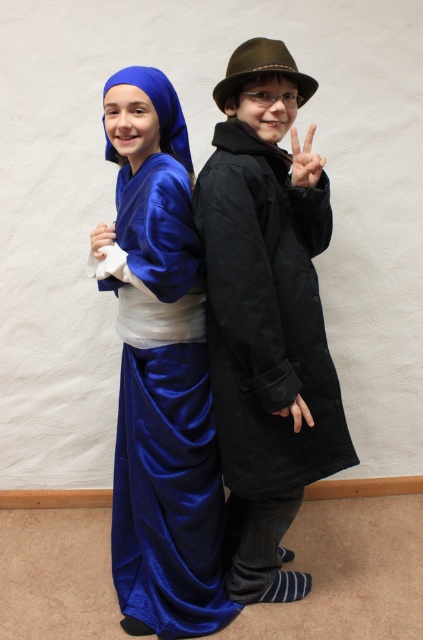
You are standing in front of the image and want to locate the point at coordinates point (266, 321). Which object is this point located on?

The point (266, 321) is located on the satin blue robe at center.

You are a photographer trying to capture a closeup of both hands in the image. Given that your camera can only focus on objects within 18 inches of each other, will you need to adjust the distance between the matte black hand at upper center and the white matte hand at center to get both in focus?

The distance between the matte black hand at upper center and the white matte hand at center is 19.03 inches, which is slightly more than the 18 inches required for the camera to focus. Therefore, you will need to move the hands closer together by at least 1.03 inches to ensure both are in focus.